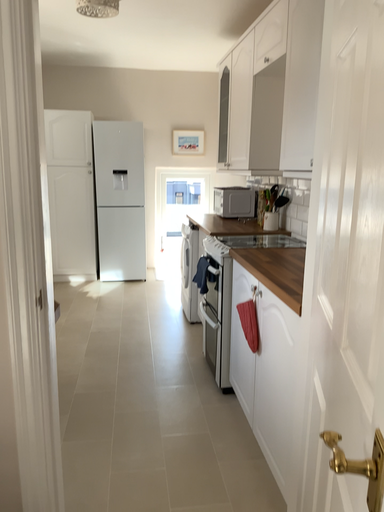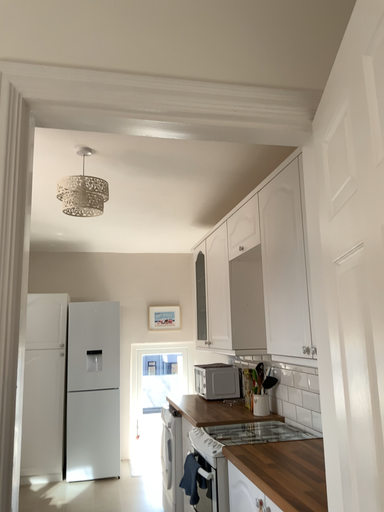
Question: How did the camera likely rotate when shooting the video?

Choices:
 (A) rotated downward
 (B) rotated upward

Answer: (B)